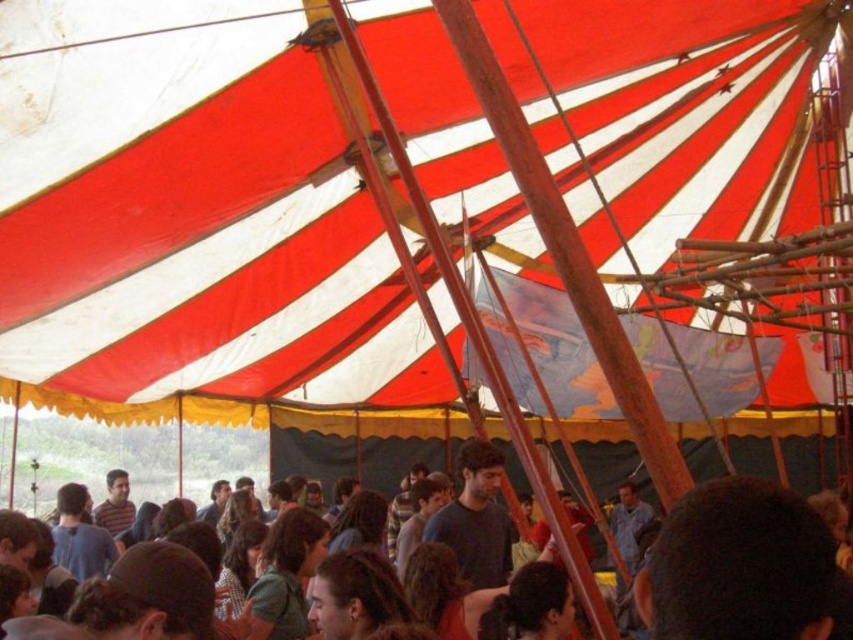
Question: Which point is closer to the camera?

Choices:
 (A) dark blue shirt at center
 (B) red/white striped canopy at upper center

Answer: (B)

Question: Is red/white striped canopy at upper center above dark blue shirt at center?

Choices:
 (A) yes
 (B) no

Answer: (A)

Question: Does red/white striped canopy at upper center appear on the right side of dark blue shirt at center?

Choices:
 (A) yes
 (B) no

Answer: (B)

Question: Does red/white striped canopy at upper center have a lesser width compared to dark blue shirt at center?

Choices:
 (A) yes
 (B) no

Answer: (B)